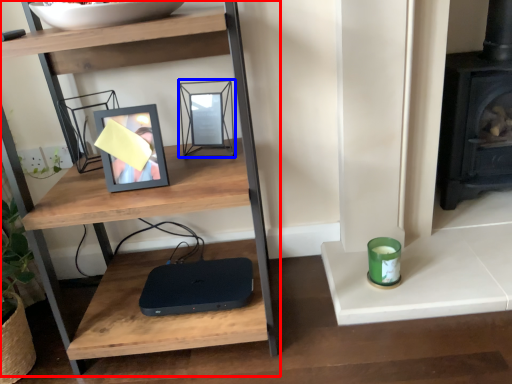
Question: Which object is closer to the camera taking this photo, shelf (highlighted by a red box) or picture frame (highlighted by a blue box)?

Choices:
 (A) shelf
 (B) picture frame

Answer: (A)